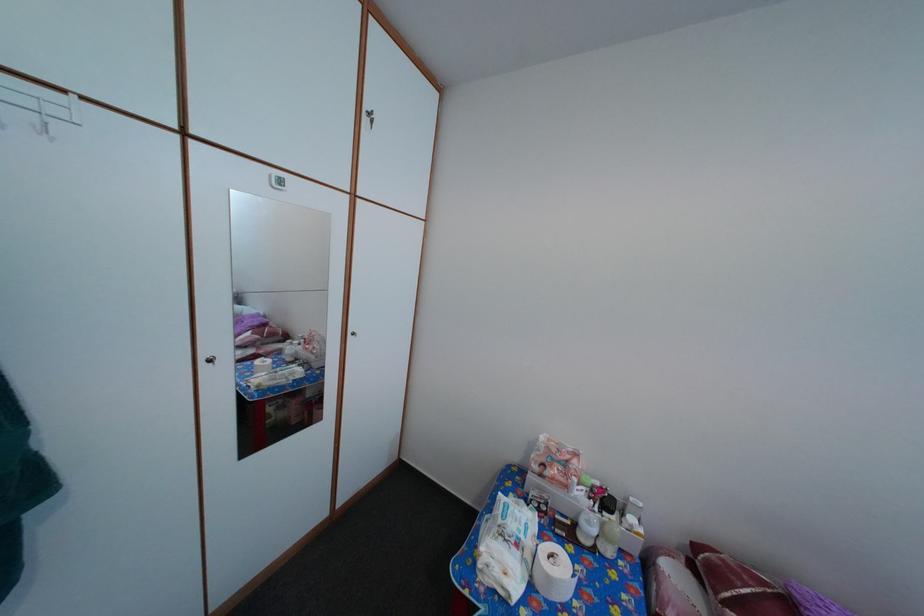
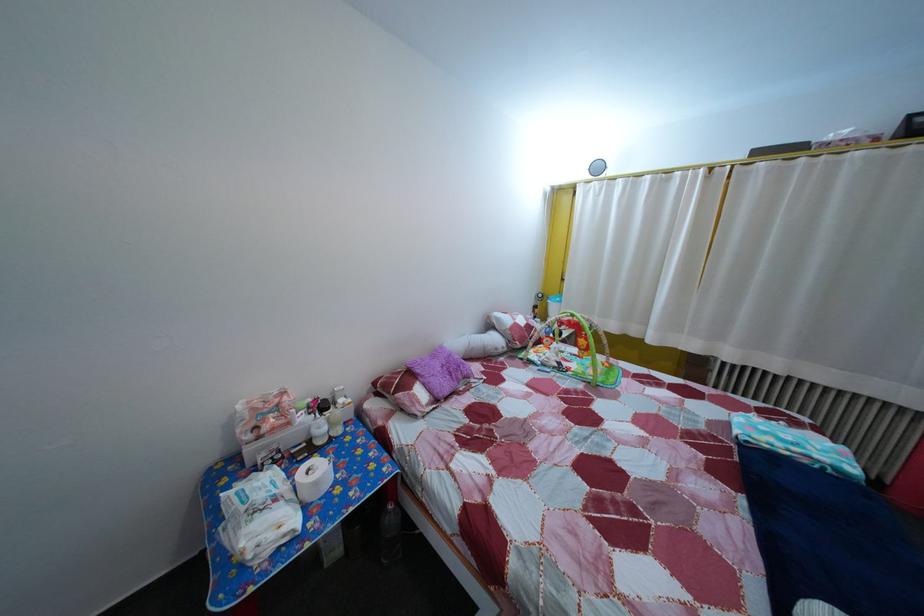
Find the pixel in the second image that matches [527,553] in the first image.

(285, 508)